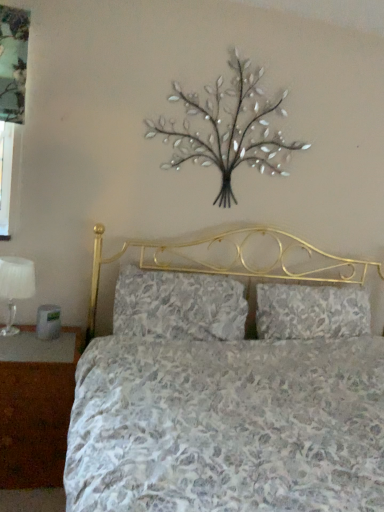
You are a GUI agent. You are given a task and a screenshot of the screen. Output one action in this format:
    pyautogui.click(x=<x>, y=<y>)
    Task: Click on the vacant space to the right of metallic gray alarm clock at left
    
    Given the screenshot: What is the action you would take?
    pyautogui.click(x=63, y=340)